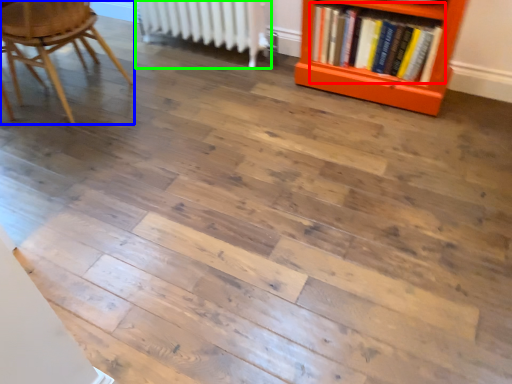
Question: Which is nearer to the book (highlighted by a red box)? chair (highlighted by a blue box) or radiator (highlighted by a green box).

Choices:
 (A) chair
 (B) radiator

Answer: (B)